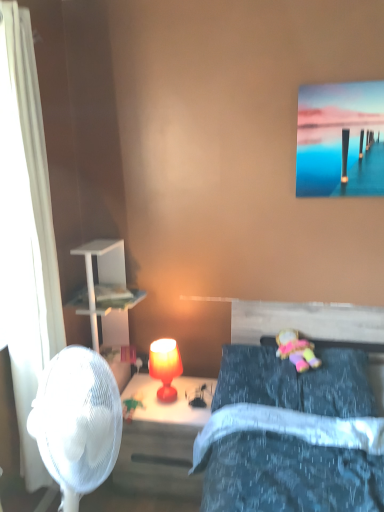
What do you see at coordinates (296, 382) in the screenshot? This screenshot has width=384, height=512. I see `velvet blue pillow at lower right` at bounding box center [296, 382].

You are a GUI agent. You are given a task and a screenshot of the screen. Output one action in this format:
    pyautogui.click(x=<x>, y=<y>)
    Task: Click on the matte red lamp at center
    
    Given the screenshot: What is the action you would take?
    pyautogui.click(x=161, y=439)

Find the location of `white sheer curtain at left`. white sheer curtain at left is located at coordinates (27, 229).

Measure the distance between plush fabric doll at center and camera.

6.14 feet.

Image resolution: width=384 pixels, height=512 pixels. I want to click on velvet blue pillow at lower right, so click(x=296, y=382).

Is the surface of matte red lamp at center in direct contact with matte orange lamp at center?

No, matte red lamp at center is not with matte orange lamp at center.

From the image's perspective, is matte red lamp at center located beneath matte orange lamp at center?

Yes, from the image's perspective, matte red lamp at center is below matte orange lamp at center.

Looking at the image, does matte red lamp at center seem bigger or smaller compared to matte orange lamp at center?

matte red lamp at center is bigger than matte orange lamp at center.

Is matte red lamp at center facing towards matte orange lamp at center?

No, matte red lamp at center is not aimed at matte orange lamp at center.

Would you say matte red lamp at center is part of velvet blue pillow at lower right's contents?

Actually, matte red lamp at center is outside velvet blue pillow at lower right.

Considering the relative sizes of velvet blue pillow at lower right and matte red lamp at center in the image provided, is velvet blue pillow at lower right wider than matte red lamp at center?

No, velvet blue pillow at lower right is not wider than matte red lamp at center.

From their relative heights in the image, would you say velvet blue pillow at lower right is taller or shorter than matte red lamp at center?

In the image, velvet blue pillow at lower right appears to be shorter than matte red lamp at center.

Is velvet blue pillow at lower right looking in the opposite direction of matte red lamp at center?

That's not correct — velvet blue pillow at lower right is not looking away from matte red lamp at center.

Is matte red lamp at center oriented away from white sheer curtain at left?

matte red lamp at center is not turned away from white sheer curtain at left.

Which of these two, matte red lamp at center or white sheer curtain at left, is smaller?

Smaller between the two is matte red lamp at center.

Can you confirm if matte red lamp at center is shorter than white sheer curtain at left?

Yes.

Does matte orange lamp at center have a lesser height compared to velvet blue pillow at lower right?

Incorrect, the height of matte orange lamp at center does not fall short of that of velvet blue pillow at lower right.

From a real-world perspective, between matte orange lamp at center and velvet blue pillow at lower right, who is vertically lower?

matte orange lamp at center is physically lower.

Is point (158, 377) more distant than point (215, 392)?

Yes, point (158, 377) is behind point (215, 392).

What's the angular difference between matte orange lamp at center and velvet blue pillow at lower right's facing directions?

The angular difference between matte orange lamp at center and velvet blue pillow at lower right is 0.803 degrees.

Considering the relative sizes of plush fabric doll at center and velvet blue pillow at lower right in the image provided, is plush fabric doll at center taller than velvet blue pillow at lower right?

Correct, plush fabric doll at center is much taller as velvet blue pillow at lower right.

Would you say plush fabric doll at center is to the left or to the right of velvet blue pillow at lower right in the picture?

plush fabric doll at center is to the right of velvet blue pillow at lower right.

From the picture: Is plush fabric doll at center aimed at velvet blue pillow at lower right?

Yes.

Does plush fabric doll at center have a greater width compared to velvet blue pillow at lower right?

In fact, plush fabric doll at center might be narrower than velvet blue pillow at lower right.

Does matte orange lamp at center have a larger size compared to plush fabric doll at center?

No.

Is matte orange lamp at center positioned with its back to plush fabric doll at center?

No, plush fabric doll at center is not at the back of matte orange lamp at center.

From a real-world perspective, is matte orange lamp at center located higher than plush fabric doll at center?

No, from a real-world perspective, matte orange lamp at center is not on top of plush fabric doll at center.

Is point (169, 355) behind point (315, 359)?

Yes, point (169, 355) is behind point (315, 359).

Measure the distance from plush fabric doll at center to white sheer curtain at left.

plush fabric doll at center and white sheer curtain at left are 3.86 feet apart.

Does plush fabric doll at center contain white sheer curtain at left?

No.

In order to click on curtain that appears in front of the plush fabric doll at center in this screenshot , I will do coord(27,229).

From the image's perspective, is plush fabric doll at center on white sheer curtain at left?

Actually, plush fabric doll at center appears below white sheer curtain at left in the image.

The width and height of the screenshot is (384, 512). In order to click on table lamp that is above the matte red lamp at center (from a real-world perspective) in this screenshot , I will do `click(165, 367)`.

Locate an element on the screen. The image size is (384, 512). nightstand lying behind the velvet blue pillow at lower right is located at coordinates (161, 439).

Which object lies nearer to the anchor point velvet blue pillow at lower right, white sheer curtain at left or matte red lamp at center?

matte red lamp at center is closer to velvet blue pillow at lower right.

When comparing their distances from matte orange lamp at center, does white sheer curtain at left or plush fabric doll at center seem further?

white sheer curtain at left is further to matte orange lamp at center.

Estimate the real-world distances between objects in this image. Which object is closer to matte orange lamp at center, velvet blue pillow at lower right or plush fabric doll at center?

velvet blue pillow at lower right is closer to matte orange lamp at center.

Which object lies further to the anchor point plush fabric doll at center, velvet blue pillow at lower right or matte orange lamp at center?

Among the two, matte orange lamp at center is located further to plush fabric doll at center.

Looking at the image, which one is located further to matte orange lamp at center, matte red lamp at center or white sheer curtain at left?

The object further to matte orange lamp at center is white sheer curtain at left.

Based on their spatial positions, is velvet blue pillow at lower right or plush fabric doll at center closer to white sheer curtain at left?

Based on the image, velvet blue pillow at lower right appears to be nearer to white sheer curtain at left.

Which object lies nearer to the anchor point white sheer curtain at left, plush fabric doll at center or velvet blue pillow at lower right?

velvet blue pillow at lower right.

When comparing their distances from plush fabric doll at center, does white sheer curtain at left or velvet blue pillow at lower right seem closer?

velvet blue pillow at lower right lies closer to plush fabric doll at center than the other object.

Locate an element on the screen. The image size is (384, 512). nightstand between white sheer curtain at left and plush fabric doll at center is located at coordinates pos(161,439).

I want to click on pillow situated between white sheer curtain at left and plush fabric doll at center from left to right, so click(296, 382).

At what (x,y) coordinates should I click in order to perform the action: click on table lamp between white sheer curtain at left and velvet blue pillow at lower right from left to right. Please return your answer as a coordinate pair (x, y). The height and width of the screenshot is (512, 384). Looking at the image, I should click on (165, 367).

Image resolution: width=384 pixels, height=512 pixels. In order to click on nightstand situated between matte orange lamp at center and plush fabric doll at center from left to right in this screenshot , I will do `click(161, 439)`.